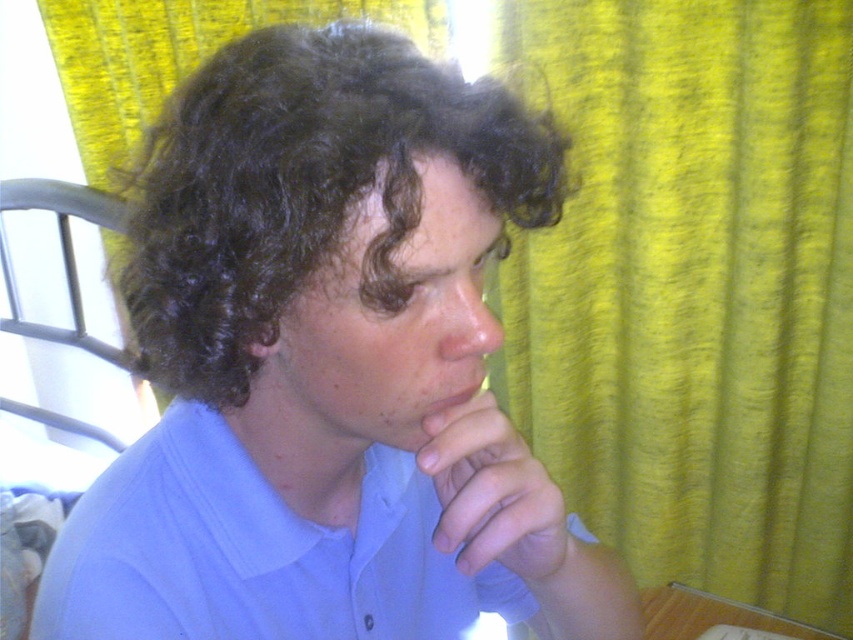
Question: Which of the following is the closest to the observer?

Choices:
 (A) (563, 65)
 (B) (450, 72)
 (C) (222, 621)

Answer: (B)

Question: Which of the following is the farthest from the observer?

Choices:
 (A) (256, 506)
 (B) (509, 61)

Answer: (B)

Question: Is the position of dark curly hair at center less distant than that of smooth skin nose at center?

Choices:
 (A) yes
 (B) no

Answer: (A)

Question: Does smooth skin hand at center have a greater width compared to matte skin mouth at center?

Choices:
 (A) yes
 (B) no

Answer: (A)

Question: Is blue cotton shirt at center closer to the viewer compared to light blue cotton shirt at center?

Choices:
 (A) no
 (B) yes

Answer: (B)

Question: Which object appears farthest from the camera in this image?

Choices:
 (A) dark curly hair at center
 (B) smooth skin hand at center
 (C) light blue cotton shirt at center

Answer: (C)